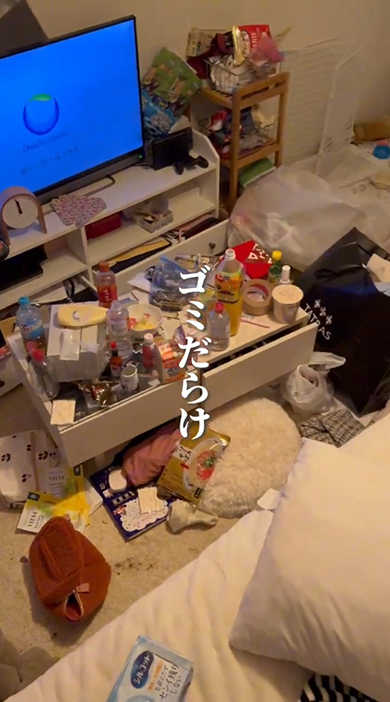
Where is `toy`? toy is located at coordinates (86, 574).